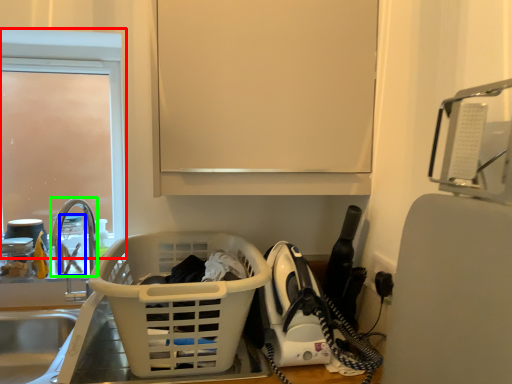
Question: Considering the real-world distances, which object is farthest from glass door (highlighted by a red box)? bottle (highlighted by a blue box) or faucet (highlighted by a green box)?

Choices:
 (A) bottle
 (B) faucet

Answer: (A)